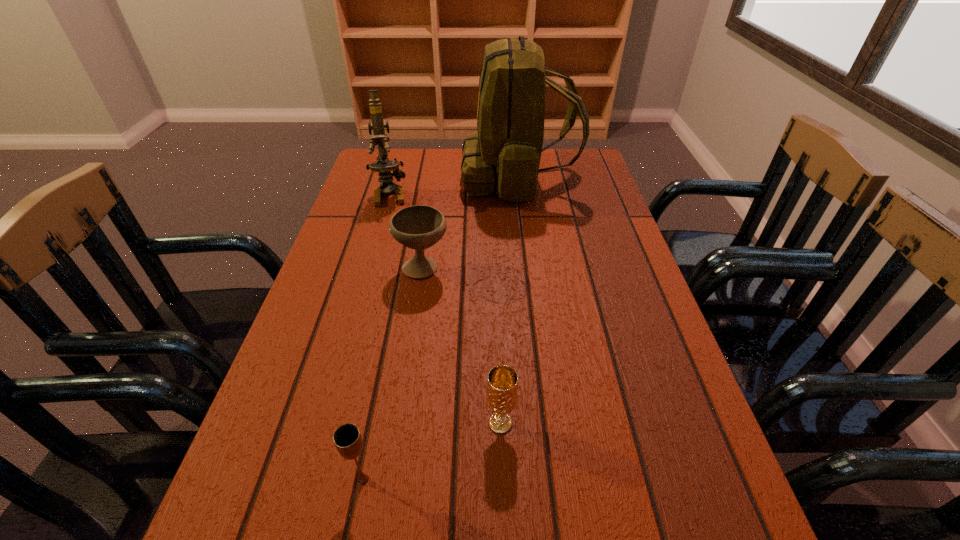
Locate which object ranks third in proximity to the microscope. Please provide its 2D coordinates. Your answer should be formatted as a tuple, i.e. [(x, y)], where the tuple contains the x and y coordinates of a point satisfying the conditions above.

[(502, 384)]

Choose which object is the second nearest neighbor to the tallest object. Please provide its 2D coordinates. Your answer should be formatted as a tuple, i.e. [(x, y)], where the tuple contains the x and y coordinates of a point satisfying the conditions above.

[(418, 227)]

The image size is (960, 540). What are the coordinates of `the third closest chalice relative to the tallest object` in the screenshot? It's located at (347, 438).

At what (x,y) coordinates should I click in order to perform the action: click on chalice that is the second closest to the nearest object. Please return your answer as a coordinate pair (x, y). The image size is (960, 540). Looking at the image, I should click on (418, 227).

You are a GUI agent. You are given a task and a screenshot of the screen. Output one action in this format:
    pyautogui.click(x=<x>, y=<y>)
    Task: Click on the vacant space that satisfies the following two spatial constraints: 1. on the front-facing side of the tallest object; 2. on the front side of the second nearest chalice
    
    Given the screenshot: What is the action you would take?
    click(x=549, y=422)

This screenshot has height=540, width=960. In order to click on vacant space that satisfies the following two spatial constraints: 1. on the front side of the nearest object; 2. on the right side of the leftmost object in this screenshot , I will do `click(307, 479)`.